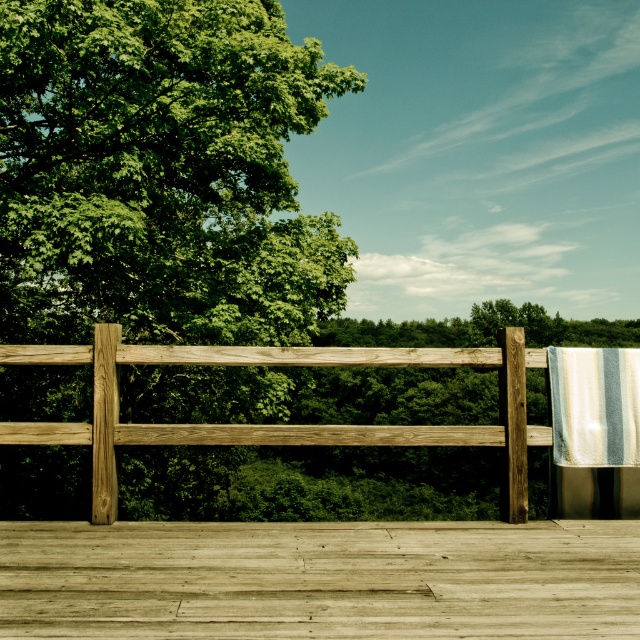
Which is above, wooden deck at center or striped fabric at right?

striped fabric at right

From the picture: Is the position of wooden deck at center more distant than that of striped fabric at right?

No.

Does point (401, 554) lie in front of point (624, 452)?

That is True.

The image size is (640, 640). I want to click on wooden deck at center, so click(x=320, y=579).

Measure the distance from green matte wood at left to striped fabric at right.

green matte wood at left and striped fabric at right are 13.93 meters apart.

Between green matte wood at left and striped fabric at right, which one is positioned higher?

green matte wood at left is higher up.

Where is `green matte wood at left`? This screenshot has height=640, width=640. green matte wood at left is located at coordinates (161, 173).

Can you confirm if wooden fence at center is bigger than striped fabric at right?

Correct, wooden fence at center is larger in size than striped fabric at right.

Does wooden fence at center have a lesser width compared to striped fabric at right?

No.

Between point (33, 358) and point (548, 372), which one is positioned in front?

Point (33, 358) is more forward.

Locate an element on the screen. wooden fence at center is located at coordinates (280, 424).